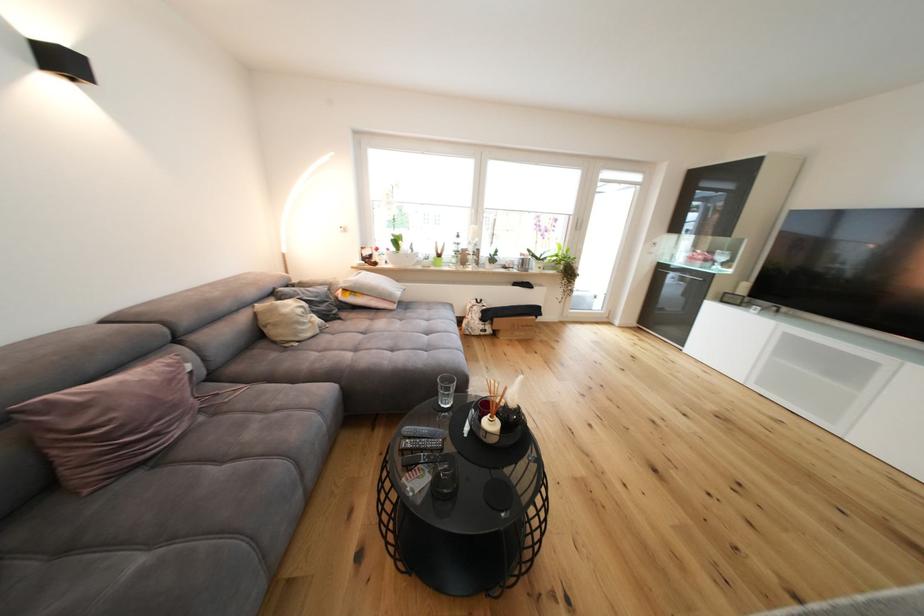
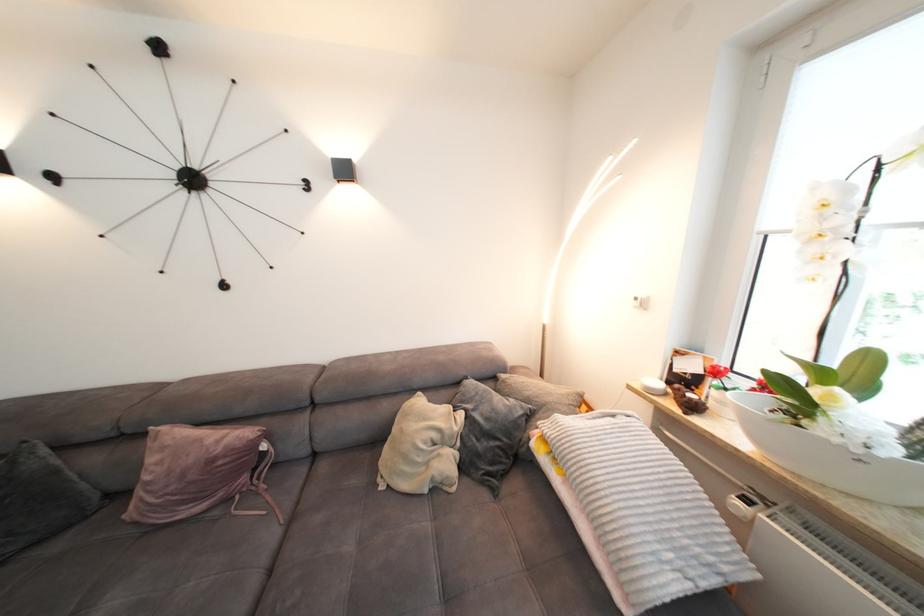
Question: I am providing you with two images of the same scene from different viewpoints. Please identify which objects are invisible in image2.

Choices:
 (A) sofa sitting surface
 (B) white wall switch
 (C) beige shaped pillow
 (D) none of these

Answer: (D)